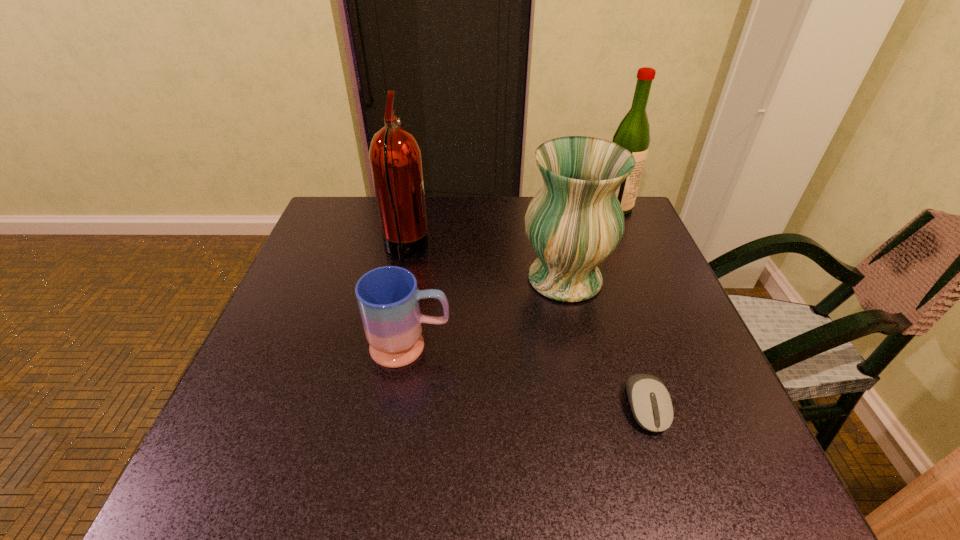
Find the location of a particular element. free location located on the label of the rightmost object is located at coordinates (x=576, y=207).

At what (x,y) coordinates should I click in order to perform the action: click on vacant space located on the front-facing side of the fire extinguisher. Please return your answer as a coordinate pair (x, y). Looking at the image, I should click on (499, 249).

Find the location of a particular element. The image size is (960, 540). free spot located 0.370m on the front of the vase is located at coordinates (609, 477).

What are the coordinates of `free space located on the side of the mug with the handle` in the screenshot? It's located at (536, 347).

Where is `liquor that is positioned at the far edge`? The height and width of the screenshot is (540, 960). liquor that is positioned at the far edge is located at coordinates (633, 133).

In order to click on fire extinguisher positioned at the far edge in this screenshot , I will do `click(395, 157)`.

Find the location of a particular element. This screenshot has width=960, height=540. liquor that is at the right edge is located at coordinates (633, 133).

This screenshot has width=960, height=540. Identify the location of vase present at the right edge. 575,221.

Where is `computer equipment present at the right edge`? The image size is (960, 540). computer equipment present at the right edge is located at coordinates (650, 401).

Locate an element on the screen. This screenshot has height=540, width=960. object present at the far right corner is located at coordinates (633, 133).